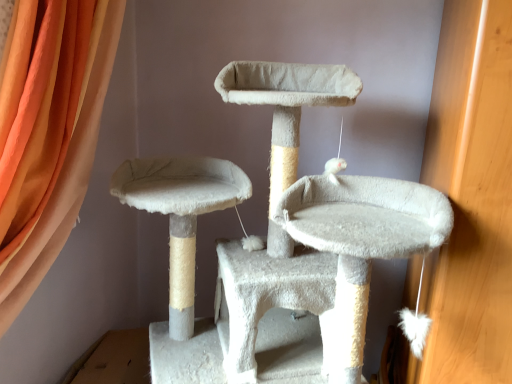
Describe the element at coordinates (279, 244) in the screenshot. This screenshot has width=512, height=384. I see `white fluffy cat furniture at center` at that location.

What is the approximate width of white fluffy cat furniture at center?

white fluffy cat furniture at center is 84.84 centimeters wide.

Locate an element on the screen. This screenshot has height=384, width=512. white fluffy cat furniture at center is located at coordinates (279, 244).

What do you see at coordinates (64, 181) in the screenshot? This screenshot has width=512, height=384. I see `orange fabric curtain at upper left` at bounding box center [64, 181].

What is the approximate height of orange fabric curtain at upper left?

1.05 meters.

Image resolution: width=512 pixels, height=384 pixels. Find the location of `orange fabric curtain at upper left`. orange fabric curtain at upper left is located at coordinates (64, 181).

Locate an element on the screen. The height and width of the screenshot is (384, 512). white fluffy cat furniture at center is located at coordinates (279, 244).

Considering the positions of objects white fluffy cat furniture at center and orange fabric curtain at upper left in the image provided, who is more to the left, white fluffy cat furniture at center or orange fabric curtain at upper left?

orange fabric curtain at upper left is more to the left.

Considering their positions, is white fluffy cat furniture at center located in front of or behind orange fabric curtain at upper left?

Visually, white fluffy cat furniture at center is located in front of orange fabric curtain at upper left.

Considering the points (354, 75) and (95, 145), which point is behind, point (354, 75) or point (95, 145)?

The point (95, 145) is more distant.

From the image's perspective, would you say white fluffy cat furniture at center is shown under orange fabric curtain at upper left?

Correct, white fluffy cat furniture at center appears lower than orange fabric curtain at upper left in the image.

From a real-world perspective, is white fluffy cat furniture at center positioned above or below orange fabric curtain at upper left?

From a real-world perspective, white fluffy cat furniture at center is physically below orange fabric curtain at upper left.

Looking at their sizes, would you say white fluffy cat furniture at center is wider or thinner than orange fabric curtain at upper left?

Clearly, white fluffy cat furniture at center has more width compared to orange fabric curtain at upper left.

Based on the photo, which of these two, white fluffy cat furniture at center or orange fabric curtain at upper left, stands taller?

white fluffy cat furniture at center.

Between white fluffy cat furniture at center and orange fabric curtain at upper left, which one has larger size?

white fluffy cat furniture at center is bigger.

Based on the photo, is orange fabric curtain at upper left surrounded by white fluffy cat furniture at center?

Actually, orange fabric curtain at upper left is outside white fluffy cat furniture at center.

Is white fluffy cat furniture at center directly adjacent to orange fabric curtain at upper left?

They are not placed beside each other.

Does white fluffy cat furniture at center turn towards orange fabric curtain at upper left?

No.

How different are the orientations of white fluffy cat furniture at center and orange fabric curtain at upper left in degrees?

The angular difference between white fluffy cat furniture at center and orange fabric curtain at upper left is 58.9 degrees.

Find the location of a particular element. This screenshot has width=512, height=384. curtain on the left of white fluffy cat furniture at center is located at coordinates (64, 181).

Can you confirm if orange fabric curtain at upper left is positioned to the right of white fluffy cat furniture at center?

In fact, orange fabric curtain at upper left is to the left of white fluffy cat furniture at center.

Is the depth of orange fabric curtain at upper left less than that of white fluffy cat furniture at center?

No, the depth of orange fabric curtain at upper left is greater than that of white fluffy cat furniture at center.

Considering the points (97, 108) and (331, 305), which point is in front, point (97, 108) or point (331, 305)?

The point (331, 305) is more forward.

From the image's perspective, who appears lower, orange fabric curtain at upper left or white fluffy cat furniture at center?

white fluffy cat furniture at center, from the image's perspective.

From a real-world perspective, is orange fabric curtain at upper left positioned above or below white fluffy cat furniture at center?

orange fabric curtain at upper left is situated higher than white fluffy cat furniture at center in the real world.

Considering the sizes of orange fabric curtain at upper left and white fluffy cat furniture at center in the image, is orange fabric curtain at upper left wider or thinner than white fluffy cat furniture at center?

Clearly, orange fabric curtain at upper left has less width compared to white fluffy cat furniture at center.

Is orange fabric curtain at upper left taller or shorter than white fluffy cat furniture at center?

Considering their sizes, orange fabric curtain at upper left has less height than white fluffy cat furniture at center.

Can you confirm if orange fabric curtain at upper left is smaller than white fluffy cat furniture at center?

Indeed, orange fabric curtain at upper left has a smaller size compared to white fluffy cat furniture at center.

Is orange fabric curtain at upper left located outside white fluffy cat furniture at center?

Yes, orange fabric curtain at upper left is outside of white fluffy cat furniture at center.

Does orange fabric curtain at upper left touch white fluffy cat furniture at center?

There is a gap between orange fabric curtain at upper left and white fluffy cat furniture at center.

Does orange fabric curtain at upper left turn towards white fluffy cat furniture at center?

Yes, orange fabric curtain at upper left faces towards white fluffy cat furniture at center.

The height and width of the screenshot is (384, 512). In order to click on cat furniture in front of the orange fabric curtain at upper left in this screenshot , I will do `click(279, 244)`.

At what (x,y) coordinates should I click in order to perform the action: click on curtain behind the white fluffy cat furniture at center. Please return your answer as a coordinate pair (x, y). The height and width of the screenshot is (384, 512). Looking at the image, I should click on (64, 181).

The image size is (512, 384). Find the location of `cat furniture below the orange fabric curtain at upper left (from the image's perspective)`. cat furniture below the orange fabric curtain at upper left (from the image's perspective) is located at coordinates (279, 244).